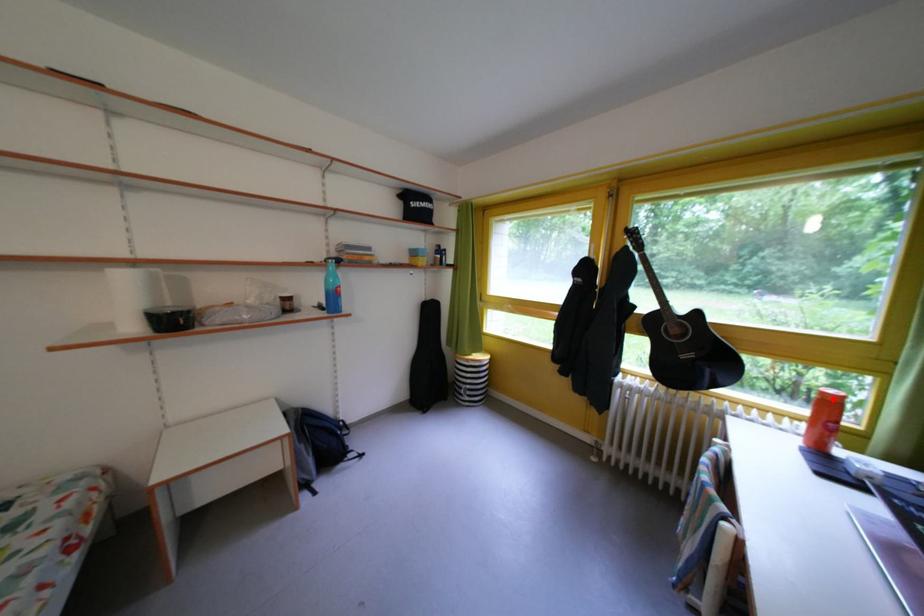
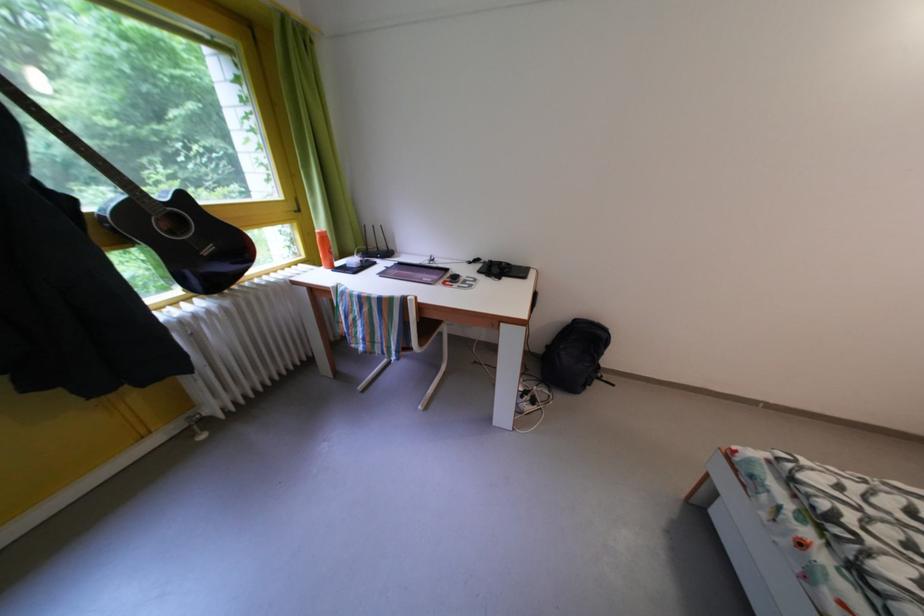
Locate, in the second image, the point that corresponds to the highlighted location in the first image.

(329, 238)